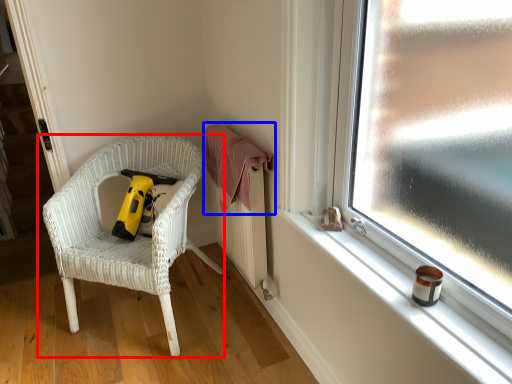
Question: Which object appears closest to the camera in this image, chair (highlighted by a red box) or clothe (highlighted by a blue box)?

Choices:
 (A) chair
 (B) clothe

Answer: (A)